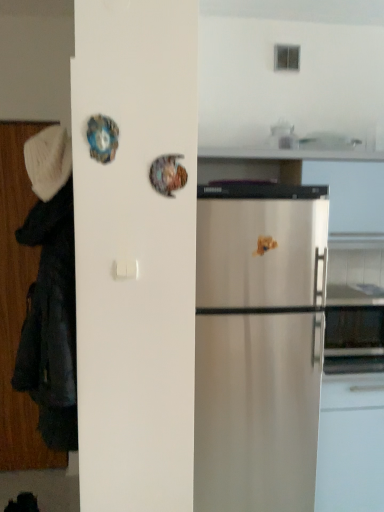
Question: Does white knitted hat at left turn towards black fabric coat at left?

Choices:
 (A) yes
 (B) no

Answer: (B)

Question: Is white knitted hat at left wider than black fabric coat at left?

Choices:
 (A) no
 (B) yes

Answer: (A)

Question: Is white knitted hat at left turned away from black fabric coat at left?

Choices:
 (A) yes
 (B) no

Answer: (B)

Question: Considering the relative positions of white knitted hat at left and black fabric coat at left in the image provided, is white knitted hat at left to the left of black fabric coat at left from the viewer's perspective?

Choices:
 (A) no
 (B) yes

Answer: (A)

Question: From a real-world perspective, does white knitted hat at left stand above black fabric coat at left?

Choices:
 (A) no
 (B) yes

Answer: (B)

Question: Can you confirm if white knitted hat at left is shorter than black fabric coat at left?

Choices:
 (A) yes
 (B) no

Answer: (A)

Question: Is white knitted hat at left completely or partially inside black fabric coat at left?

Choices:
 (A) yes
 (B) no

Answer: (A)

Question: Is black fabric coat at left to the right of white knitted hat at left from the viewer's perspective?

Choices:
 (A) yes
 (B) no

Answer: (B)

Question: Considering the relative sizes of black fabric coat at left and white knitted hat at left in the image provided, is black fabric coat at left taller than white knitted hat at left?

Choices:
 (A) no
 (B) yes

Answer: (B)

Question: Considering the relative positions of black fabric coat at left and white knitted hat at left in the image provided, is black fabric coat at left to the left of white knitted hat at left from the viewer's perspective?

Choices:
 (A) yes
 (B) no

Answer: (A)

Question: From a real-world perspective, is black fabric coat at left positioned over white knitted hat at left based on gravity?

Choices:
 (A) no
 (B) yes

Answer: (A)

Question: From a real-world perspective, is black fabric coat at left beneath white knitted hat at left?

Choices:
 (A) no
 (B) yes

Answer: (B)

Question: Based on their sizes in the image, would you say black fabric coat at left is bigger or smaller than white knitted hat at left?

Choices:
 (A) big
 (B) small

Answer: (A)